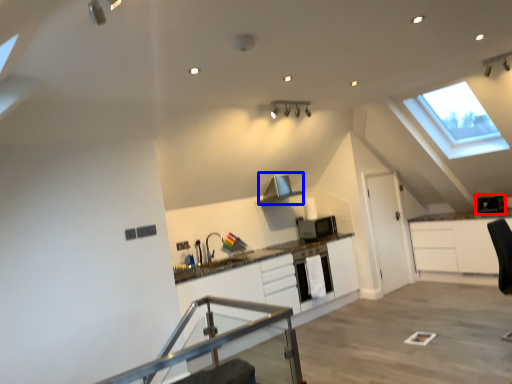
Question: Which object is further to the camera taking this photo, appliance (highlighted by a red box) or exhaust hood (highlighted by a blue box)?

Choices:
 (A) appliance
 (B) exhaust hood

Answer: (A)